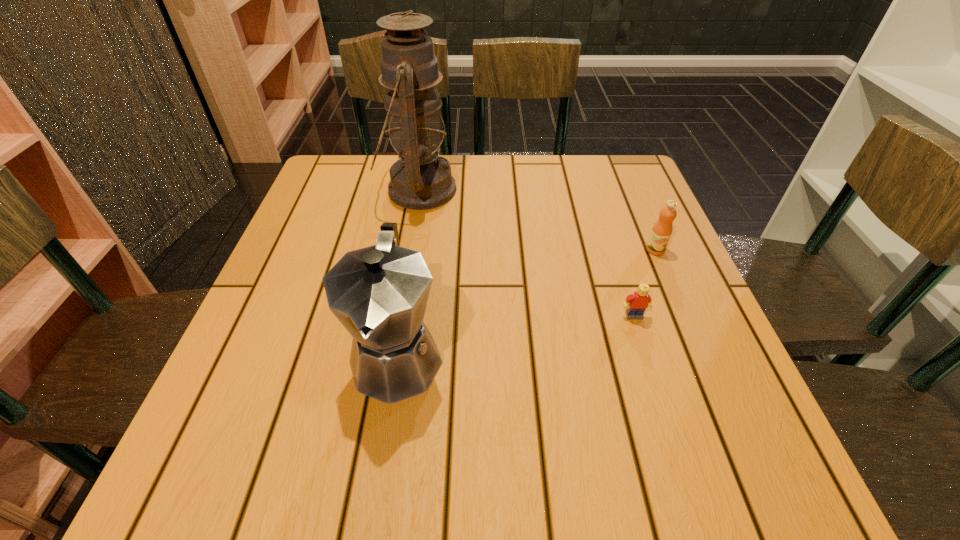
I want to click on the farthest object, so click(420, 179).

Identify the location of oil lamp. Image resolution: width=960 pixels, height=540 pixels. (420, 179).

You are a GUI agent. You are given a task and a screenshot of the screen. Output one action in this format:
    pyautogui.click(x=<x>, y=<y>)
    Task: Click on the coffeepot
    
    Given the screenshot: What is the action you would take?
    pyautogui.click(x=379, y=293)

Identify the location of orange juice. (661, 232).

At what (x,y) coordinates should I click in order to perform the action: click on the third nearest object. Please return your answer as a coordinate pair (x, y). Looking at the image, I should click on (661, 232).

This screenshot has width=960, height=540. Identify the location of the second object from right to left. (636, 303).

You are a GUI agent. You are given a task and a screenshot of the screen. Output one action in this format:
    pyautogui.click(x=<x>, y=<y>)
    Task: Click on the Lego
    
    Given the screenshot: What is the action you would take?
    pyautogui.click(x=636, y=303)

What are the coordinates of `blank space located on the front of the oil lamp` in the screenshot? It's located at (394, 330).

Find the location of `vacant position located 0.100m at the spout of the coffeepot`. vacant position located 0.100m at the spout of the coffeepot is located at coordinates (377, 483).

The height and width of the screenshot is (540, 960). Identify the location of free space located on the front label of the third nearest object. (697, 348).